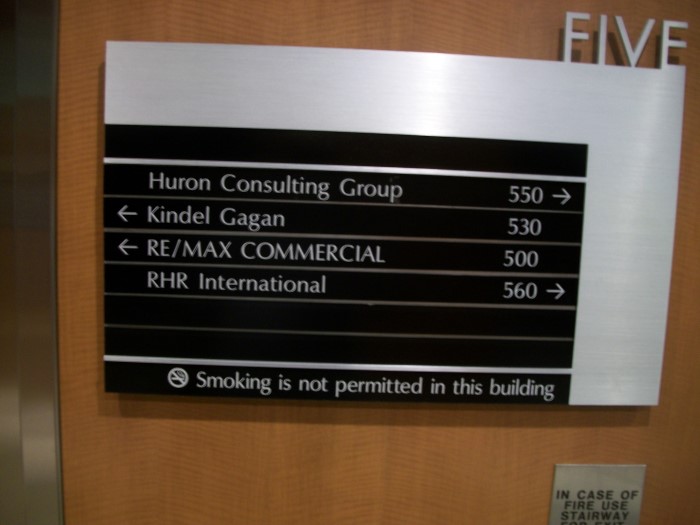
This screenshot has width=700, height=525. I want to click on wall, so click(253, 480).